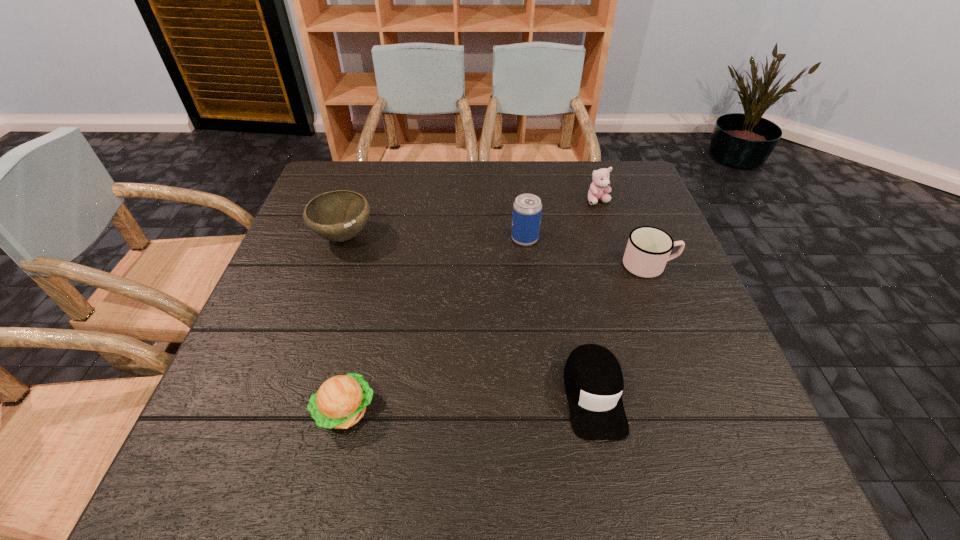
Find the location of `the third object from left to right`. the third object from left to right is located at coordinates (527, 208).

The image size is (960, 540). I want to click on teddy bear, so click(x=600, y=184).

The width and height of the screenshot is (960, 540). What are the coordinates of `bowl` in the screenshot? It's located at (340, 215).

The height and width of the screenshot is (540, 960). In order to click on mug in this screenshot , I will do `click(648, 250)`.

You are a GUI agent. You are given a task and a screenshot of the screen. Output one action in this format:
    pyautogui.click(x=<x>, y=<y>)
    Task: Click on the hamburger
    The image size is (960, 540).
    Given the screenshot: What is the action you would take?
    pyautogui.click(x=340, y=402)

At what (x,y) coordinates should I click in order to perform the action: click on cap. Please return your answer as a coordinate pair (x, y). Looking at the image, I should click on (593, 379).

Find the location of `free space located on the back of the beer can`. free space located on the back of the beer can is located at coordinates (521, 207).

At what (x,y) coordinates should I click in order to perform the action: click on free location located 0.400m at the face of the farthest object. Please return your answer as a coordinate pair (x, y). This screenshot has width=960, height=540. Looking at the image, I should click on (636, 319).

Where is `vacant region located 0.390m on the front of the bowl`? vacant region located 0.390m on the front of the bowl is located at coordinates (288, 401).

Locate an element on the screen. Image resolution: width=960 pixels, height=540 pixels. free space located on the back of the hamburger is located at coordinates (384, 246).